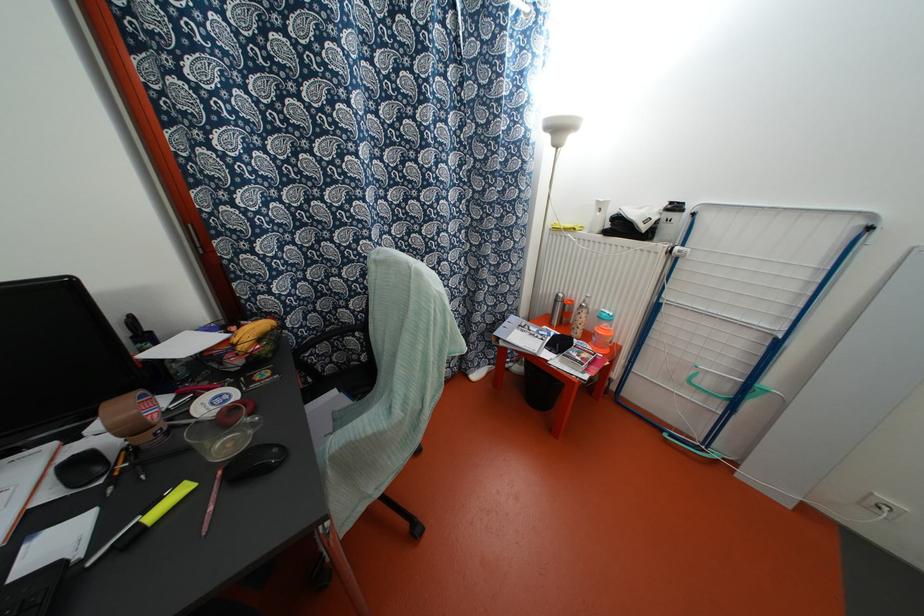
Describe the element at coordinates (223, 434) in the screenshot. The height and width of the screenshot is (616, 924). I see `a clear cup handle` at that location.